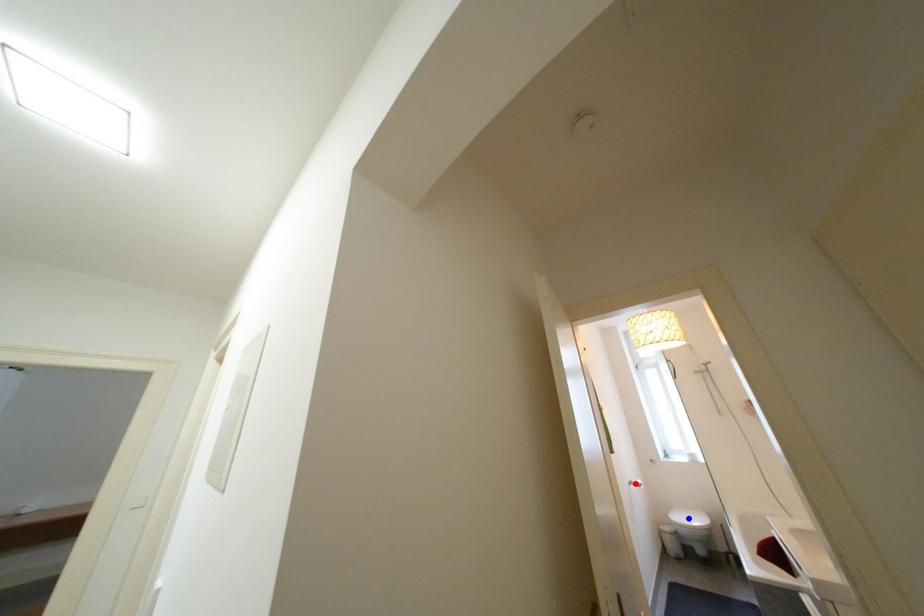
Question: In the image, two points are highlighted. Which point is nearer to the camera? Reply with the corresponding letter.

Choices:
 (A) blue point
 (B) red point

Answer: (B)